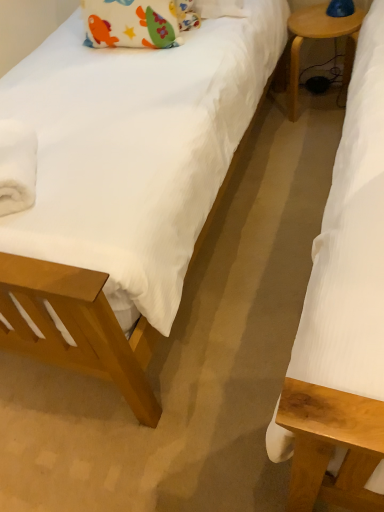
This screenshot has width=384, height=512. What are the coordinates of `wooden side table at right` in the screenshot? It's located at (320, 38).

I want to click on soft cotton pillow at upper left, so click(x=136, y=22).

What do you see at coordinates (17, 166) in the screenshot? I see `white fluffy towel at left` at bounding box center [17, 166].

Find the location of `white fluffy towel at left`. white fluffy towel at left is located at coordinates (17, 166).

The width and height of the screenshot is (384, 512). Identify the location of wooden side table at right. (320, 38).

Is white fluffy towel at left at the back of wooden side table at right?

No, wooden side table at right is not facing the opposite direction of white fluffy towel at left.

Which is nearer, (293, 62) or (35, 159)?

The point (35, 159) is closer to the camera.

In the scene shown: Considering the sizes of objects wooden side table at right and white fluffy towel at left in the image provided, who is bigger, wooden side table at right or white fluffy towel at left?

wooden side table at right is bigger.

Can you confirm if wooden side table at right is thinner than white fluffy towel at left?

Indeed, wooden side table at right has a lesser width compared to white fluffy towel at left.

Is wooden side table at right looking in the opposite direction of soft cotton pillow at upper left?

No, wooden side table at right's orientation is not away from soft cotton pillow at upper left.

From a real-world perspective, who is located lower, wooden side table at right or soft cotton pillow at upper left?

In real-world perspective, wooden side table at right is lower.

From the image's perspective, which object appears higher, wooden side table at right or soft cotton pillow at upper left?

wooden side table at right, from the image's perspective.

Which is in front, soft cotton pillow at upper left or white fluffy towel at left?

Positioned in front is white fluffy towel at left.

From a real-world perspective, which is physically below, soft cotton pillow at upper left or white fluffy towel at left?

white fluffy towel at left is physically lower.

Between soft cotton pillow at upper left and white fluffy towel at left, which one has more height?

With more height is soft cotton pillow at upper left.

Which point is more forward, [113,0] or [11,149]?

The point [11,149] is closer to the camera.

Considering the sizes of soft cotton pillow at upper left and wooden side table at right in the image, is soft cotton pillow at upper left bigger or smaller than wooden side table at right?

Clearly, soft cotton pillow at upper left is smaller in size than wooden side table at right.

In terms of height, does soft cotton pillow at upper left look taller or shorter compared to wooden side table at right?

In the image, soft cotton pillow at upper left appears to be shorter than wooden side table at right.

Identify the location of pillow on the left of wooden side table at right. The image size is (384, 512). (136, 22).

Considering the positions of objects soft cotton pillow at upper left and wooden side table at right in the image provided, who is behind, soft cotton pillow at upper left or wooden side table at right?

wooden side table at right is further from the camera.

Considering the relative sizes of white fluffy towel at left and soft cotton pillow at upper left in the image provided, is white fluffy towel at left thinner than soft cotton pillow at upper left?

In fact, white fluffy towel at left might be wider than soft cotton pillow at upper left.

From the picture: Is soft cotton pillow at upper left located within white fluffy towel at left?

No, soft cotton pillow at upper left is not inside white fluffy towel at left.

Is point (13, 134) closer or farther from the camera than point (159, 45)?

Point (13, 134) appears to be closer to the viewer than point (159, 45).

Which object is positioned more to the left, white fluffy towel at left or wooden side table at right?

white fluffy towel at left.

Choose the correct answer: Is white fluffy towel at left inside wooden side table at right or outside it?

white fluffy towel at left is not enclosed by wooden side table at right.

Between white fluffy towel at left and wooden side table at right, which one is positioned in front?

Positioned in front is white fluffy towel at left.

Is white fluffy towel at left bigger or smaller than wooden side table at right?

In the image, white fluffy towel at left appears to be smaller than wooden side table at right.

Locate an element on the screen. Image resolution: width=384 pixels, height=512 pixels. table behind the white fluffy towel at left is located at coordinates (320, 38).

Find the location of a particular element. The image size is (384, 512). pillow on the left side of wooden side table at right is located at coordinates (136, 22).

Which object lies further to the anchor point white fluffy towel at left, soft cotton pillow at upper left or wooden side table at right?

The object further to white fluffy towel at left is wooden side table at right.

From the image, which object appears to be nearer to wooden side table at right, white fluffy towel at left or soft cotton pillow at upper left?

soft cotton pillow at upper left.

Looking at the image, which one is located further to soft cotton pillow at upper left, white fluffy towel at left or wooden side table at right?

The object further to soft cotton pillow at upper left is white fluffy towel at left.

Looking at the image, which one is located further to wooden side table at right, soft cotton pillow at upper left or white fluffy towel at left?

white fluffy towel at left.

Which object lies nearer to the anchor point soft cotton pillow at upper left, wooden side table at right or white fluffy towel at left?

wooden side table at right.

Which object lies nearer to the anchor point white fluffy towel at left, wooden side table at right or soft cotton pillow at upper left?

soft cotton pillow at upper left lies closer to white fluffy towel at left than the other object.

I want to click on pillow between white fluffy towel at left and wooden side table at right, so pos(136,22).